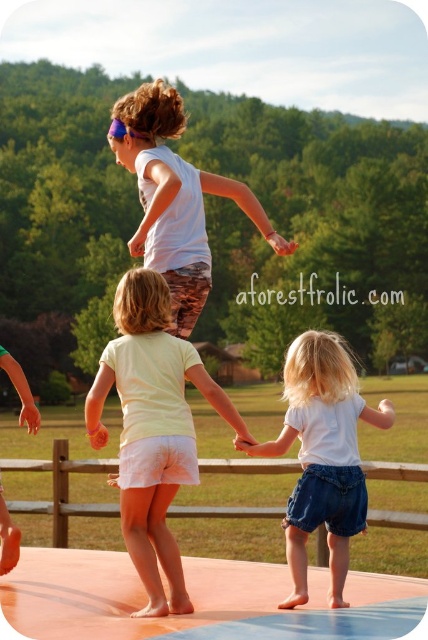
You are a photographer trying to capture a photo of the children on the trampoline. You want to ensure the yellow cotton shirt at center is in the center of your shot. What adjustment should you make to your camera position?

Since the yellow cotton shirt at center is located at point 0.670 on the x and 0.357 on the y, you should move your camera to the left and up to center the subject.

You are a photographer trying to capture a group photo of the children. You notice two shirts in the scene, the yellow cotton shirt at center and the white matte shirt at upper center. Which child should you ask to stand on a stool so that their head reaches the same level as the other?

The white matte shirt at upper center is shorter in height compared to the yellow cotton shirt at center. Therefore, you should ask the child wearing the white matte shirt at upper center to stand on a stool to match the height of the other child.